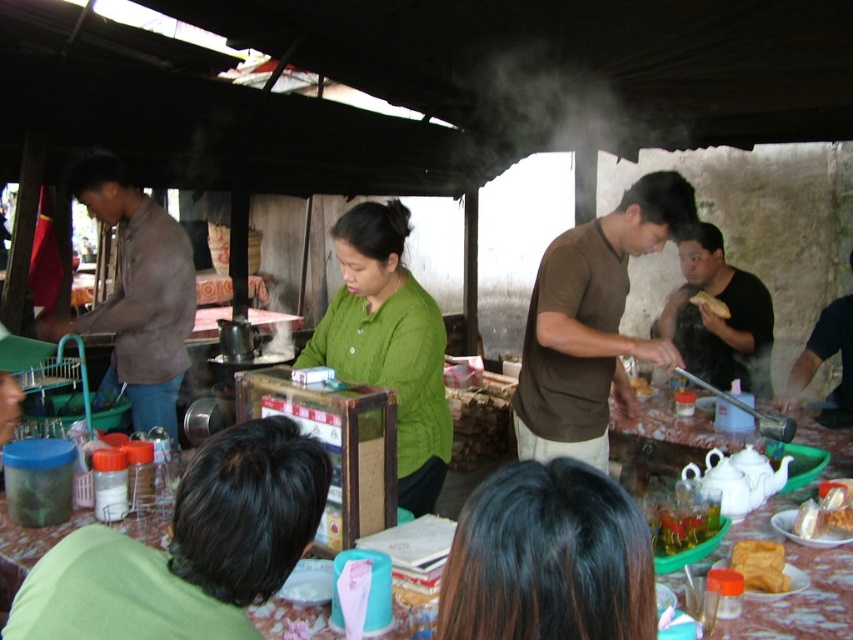
Question: In this image, where is green knitted sweater at center located relative to yellow fried food at center?

Choices:
 (A) right
 (B) left

Answer: (B)

Question: Which is farther from the black matte shirt at center?

Choices:
 (A) golden crispy pastry at lower right
 (B) yellow fried food at center

Answer: (A)

Question: Is golden crispy pastry at right to the left of yellow fried food at center from the viewer's perspective?

Choices:
 (A) yes
 (B) no

Answer: (B)

Question: Which of the following is the farthest from the observer?

Choices:
 (A) black matte shirt at center
 (B) golden crispy pastry at right

Answer: (B)

Question: Can you confirm if shiny brown hair at center is wider than yellow fried food at center?

Choices:
 (A) no
 (B) yes

Answer: (B)

Question: Which point appears farthest from the camera in this image?

Choices:
 (A) (706, 300)
 (B) (401, 340)
 (C) (613, 368)

Answer: (A)